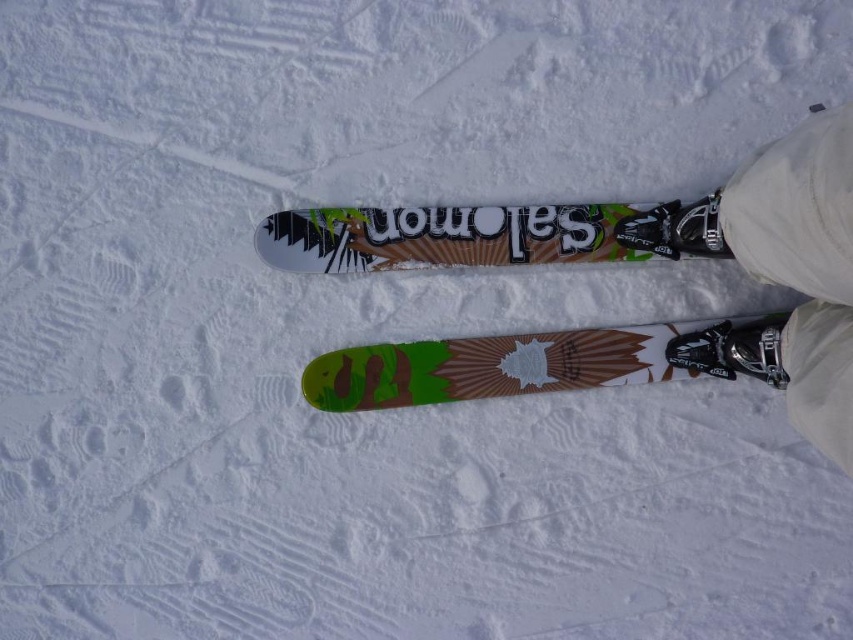
Question: Which is nearer to the metallic silver ski boot at lower right?

Choices:
 (A) matte black ski boot at center
 (B) multicolored glossy snowboard at center
 (C) white fabric pants at lower right
 (D) green matte snowboard at center

Answer: (A)

Question: Does green matte snowboard at center have a larger size compared to matte black ski boot at center?

Choices:
 (A) yes
 (B) no

Answer: (A)

Question: Considering the relative positions of white fabric pants at lower right and metallic silver ski boot at lower right in the image provided, where is white fabric pants at lower right located with respect to metallic silver ski boot at lower right?

Choices:
 (A) below
 (B) above

Answer: (B)

Question: Considering the relative positions of multicolored glossy snowboard at center and metallic silver ski boot at lower right in the image provided, where is multicolored glossy snowboard at center located with respect to metallic silver ski boot at lower right?

Choices:
 (A) above
 (B) below

Answer: (A)

Question: Among these objects, which one is farthest from the camera?

Choices:
 (A) metallic silver ski boot at lower right
 (B) matte black ski boot at center
 (C) green matte snowboard at center

Answer: (C)

Question: Which of the following is the farthest from the observer?

Choices:
 (A) (717, 220)
 (B) (489, 387)

Answer: (B)